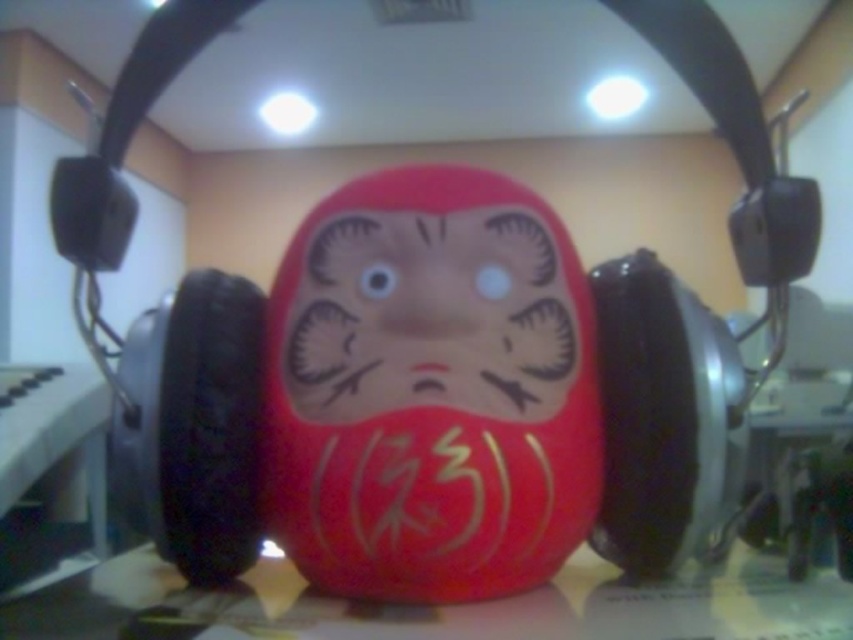
You are a photographer setting up a shot of the matte red daruma doll at center and the matte plastic table at center. You need to ensure that the taller object is in focus. Which object should you focus on?

The matte red daruma doll at center is taller than the matte plastic table at center, so you should focus on the matte red daruma doll at center as it is the taller object.

You are a photographer trying to capture the matte red daruma doll at center and the matte plastic table at center in a single shot. Based on their positions, which object should you focus on to ensure the other remains in the background?

The matte red daruma doll at center is above the matte plastic table at center, so focusing on the matte red daruma doll at center will keep the matte plastic table at center in the background.